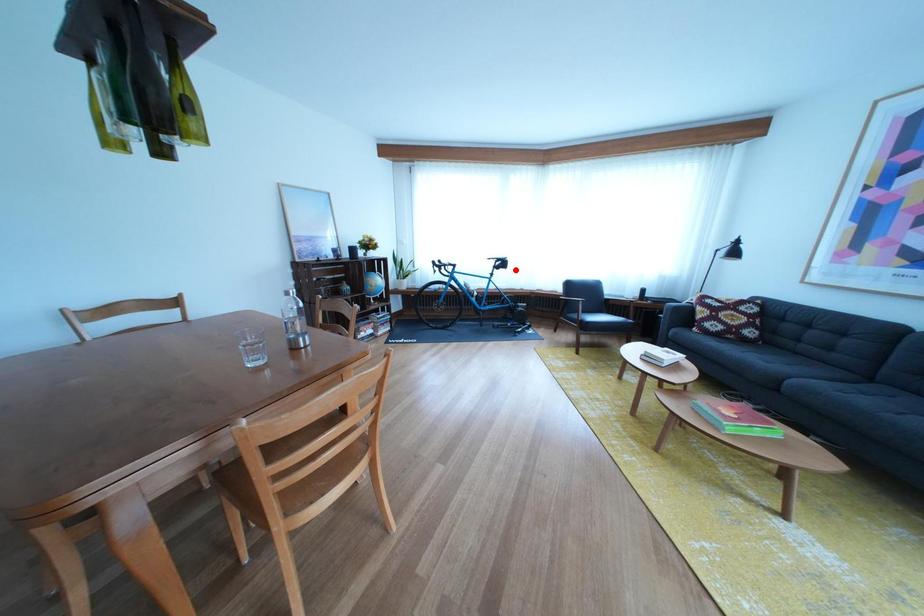
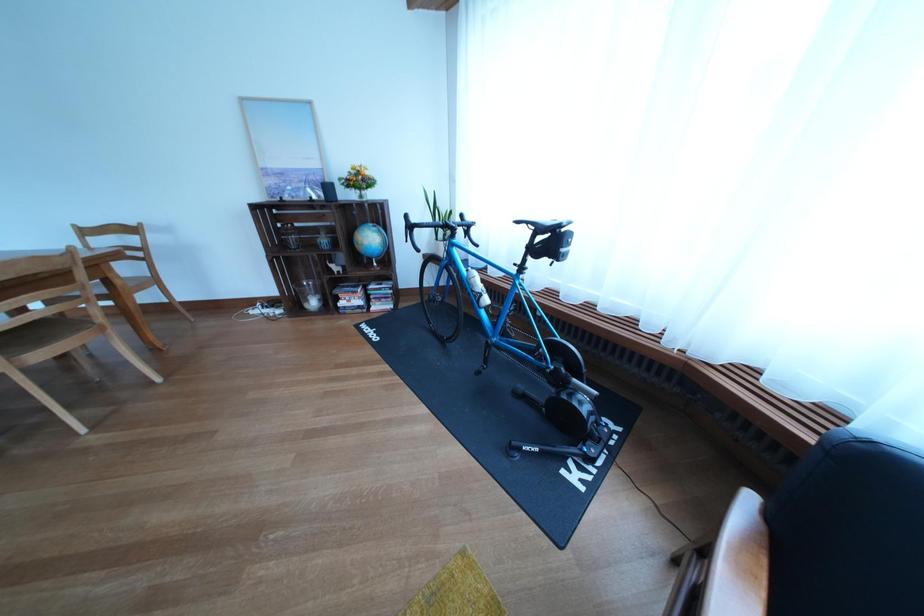
Locate, in the second image, the point that corresponds to the highlighted location in the first image.

(563, 248)